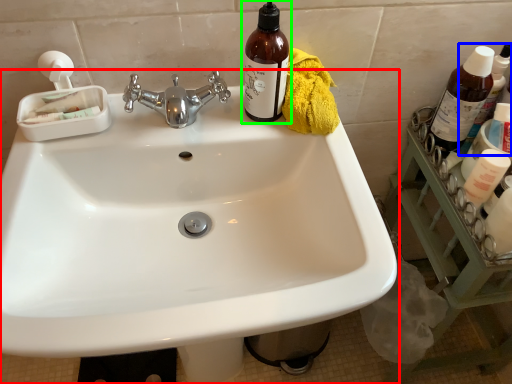
Question: Which is farther away from sink (highlighted by a red box)? bottle (highlighted by a blue box) or bottle (highlighted by a green box)?

Choices:
 (A) bottle
 (B) bottle

Answer: (A)